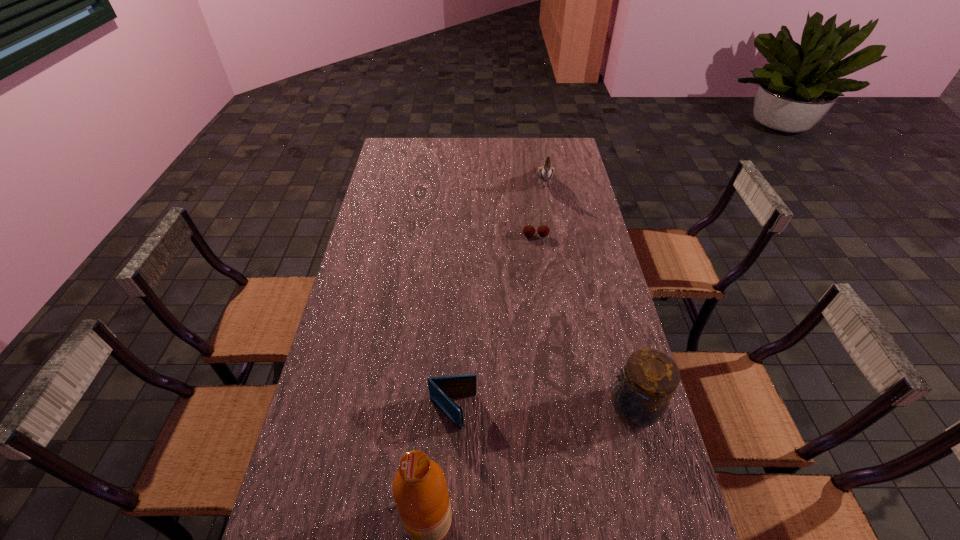
Identify the location of vacant space situated 0.120m at the face of the farthest object. (545, 216).

Locate an element on the screen. This screenshot has height=540, width=960. free space located 0.310m at the face of the farthest object is located at coordinates (543, 248).

Where is `free space located at the face of the farthest object`? This screenshot has width=960, height=540. free space located at the face of the farthest object is located at coordinates (543, 257).

You are a GUI agent. You are given a task and a screenshot of the screen. Output one action in this format:
    pyautogui.click(x=<x>, y=<y>)
    Task: Click on the free space located 0.120m on the exterior surface of the wallet
    Image resolution: width=960 pixels, height=540 pixels.
    Given the screenshot: What is the action you would take?
    click(502, 459)

This screenshot has width=960, height=540. I want to click on vacant region located on the exterior surface of the wallet, so click(517, 474).

Locate an element on the screen. This screenshot has height=540, width=960. free region located 0.310m on the exterior surface of the wallet is located at coordinates (564, 520).

This screenshot has height=540, width=960. Find the location of `jar that is at the right edge`. jar that is at the right edge is located at coordinates (649, 379).

Identify the location of bird located in the right edge section of the desktop. (545, 173).

The image size is (960, 540). In the image, there is a desktop. Identify the location of vacant region at the far edge. (477, 160).

Identify the location of vacant region at the left edge of the desktop. Image resolution: width=960 pixels, height=540 pixels. (369, 229).